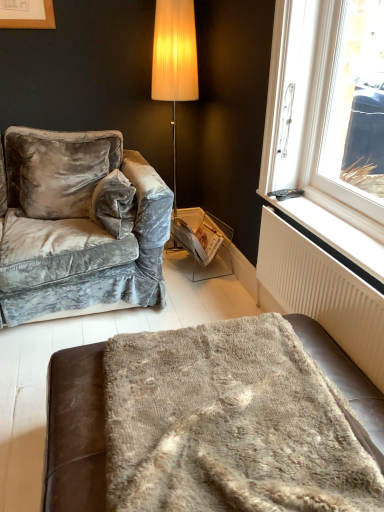
Question: Is white plastic window at upper right spatially inside fuzzy beige blanket at lower center, or outside of it?

Choices:
 (A) inside
 (B) outside

Answer: (B)

Question: Relative to fuzzy beige blanket at lower center, is white plastic window at upper right in front or behind?

Choices:
 (A) behind
 (B) front

Answer: (A)

Question: Which of these objects is positioned closest to the white plastic window at upper right?

Choices:
 (A) velvet gray couch at left
 (B) white textured radiator at lower right
 (C) white plastic radiator at lower right
 (D) fuzzy beige blanket at lower center
 (E) white glossy magazine at center

Answer: (C)

Question: Estimate the real-world distances between objects in this image. Which object is closer to the white plastic window at upper right?

Choices:
 (A) velvet gray couch at left
 (B) fuzzy beige blanket at lower center
 (C) white textured radiator at lower right
 (D) white glossy magazine at center
 (E) white plastic radiator at lower right

Answer: (E)